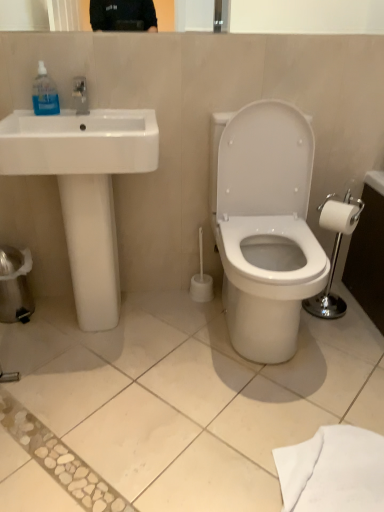
Question: In terms of size, does white matte toilet paper at right appear bigger or smaller than white glossy sink at left?

Choices:
 (A) small
 (B) big

Answer: (A)

Question: Is white matte toilet paper at right inside or outside of white glossy sink at left?

Choices:
 (A) inside
 (B) outside

Answer: (B)

Question: Considering the real-world distances, which object is farthest from the white glossy sink at left?

Choices:
 (A) white matte toilet paper at right
 (B) white glossy toilet at center
 (C) transparent plastic hand sanitizer at upper left

Answer: (A)

Question: Estimate the real-world distances between objects in this image. Which object is closer to the white matte toilet paper at right?

Choices:
 (A) transparent plastic hand sanitizer at upper left
 (B) white glossy sink at left
 (C) white glossy toilet at center

Answer: (C)